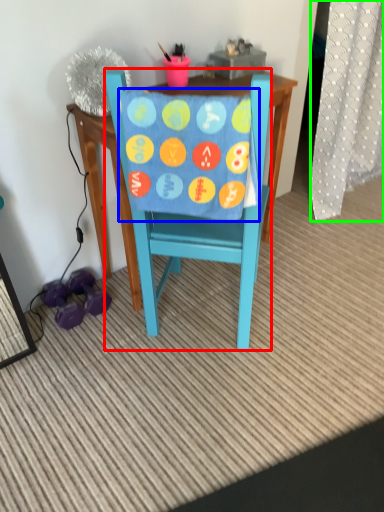
Question: Which object is the farthest from chair (highlighted by a red box)? Choose among these: blanket (highlighted by a blue box) or curtain (highlighted by a green box).

Choices:
 (A) blanket
 (B) curtain

Answer: (B)